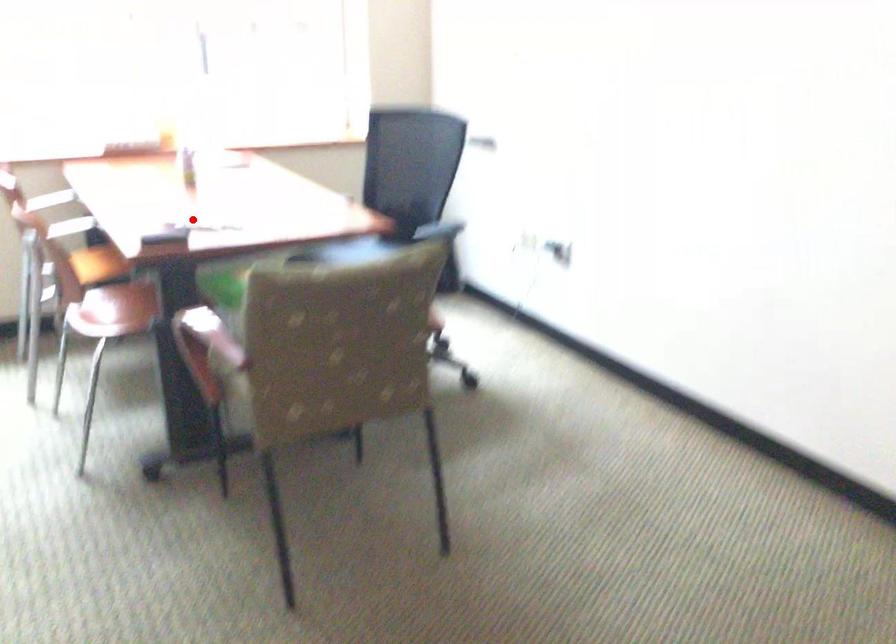
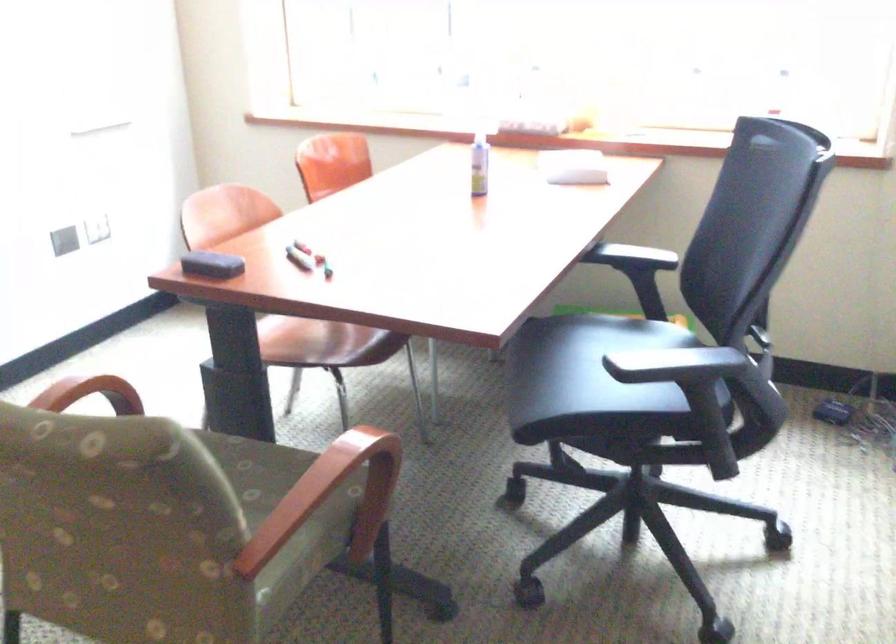
In the second image, find the point that corresponds to the highlighted location in the first image.

(299, 258)